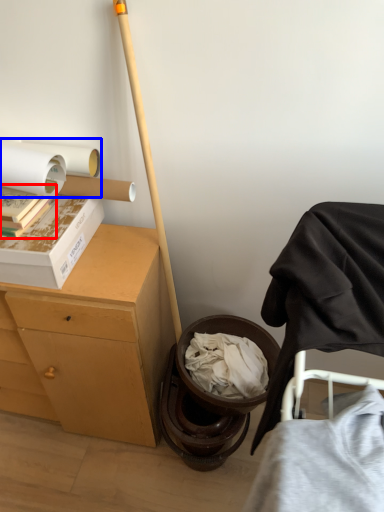
Question: Which object is further to the camera taking this photo, book (highlighted by a red box) or toilet paper (highlighted by a blue box)?

Choices:
 (A) book
 (B) toilet paper

Answer: (B)